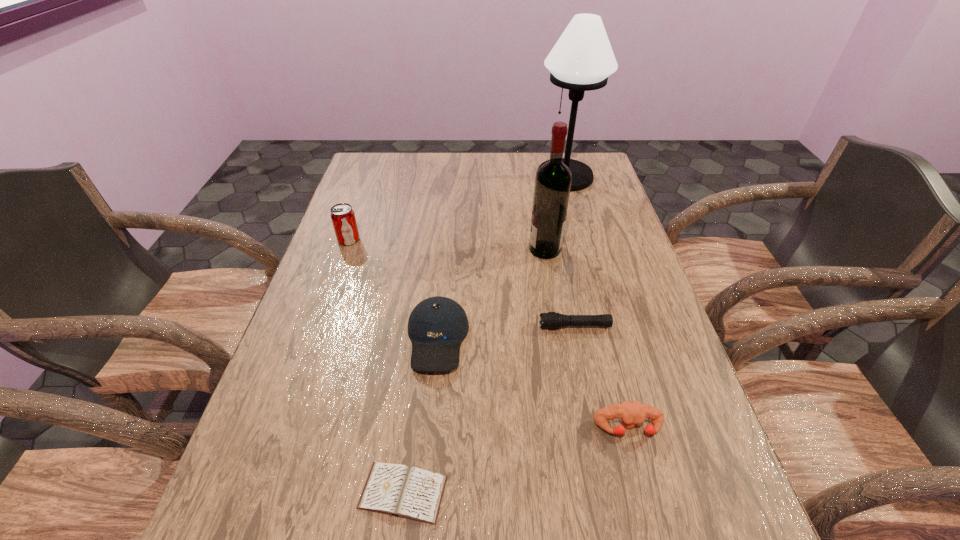
Where is `free space located at the lens end of the flashlight`? The image size is (960, 540). free space located at the lens end of the flashlight is located at coordinates (480, 326).

Locate an element on the screen. This screenshot has width=960, height=540. vacant space situated 0.150m on the left of the shortest object is located at coordinates (273, 492).

The height and width of the screenshot is (540, 960). Identify the location of object that is at the far edge. (582, 59).

Find the location of `object positioned at the left edge`. object positioned at the left edge is located at coordinates (342, 215).

You are a GUI agent. You are given a task and a screenshot of the screen. Output one action in this format:
    pyautogui.click(x=<x>, y=<y>)
    Task: Click on the table lamp that is at the right edge
    This screenshot has height=540, width=960.
    Given the screenshot: What is the action you would take?
    [582, 59]

You are a GUI agent. You are given a task and a screenshot of the screen. Output one action in this format:
    pyautogui.click(x=<x>, y=<y>)
    Task: Click on the puncher that is at the right edge
    This screenshot has height=540, width=960.
    Given the screenshot: What is the action you would take?
    pyautogui.click(x=632, y=413)

Where is `flashlight located at the right edge`? The height and width of the screenshot is (540, 960). flashlight located at the right edge is located at coordinates pos(551,320).

Where is `object located at the far right corner`? This screenshot has height=540, width=960. object located at the far right corner is located at coordinates (582, 59).

In order to click on vacant region at the far edge of the desktop in this screenshot , I will do `click(513, 180)`.

This screenshot has height=540, width=960. In the image, there is a desktop. What are the coordinates of `vacant space at the left edge` in the screenshot? It's located at (292, 386).